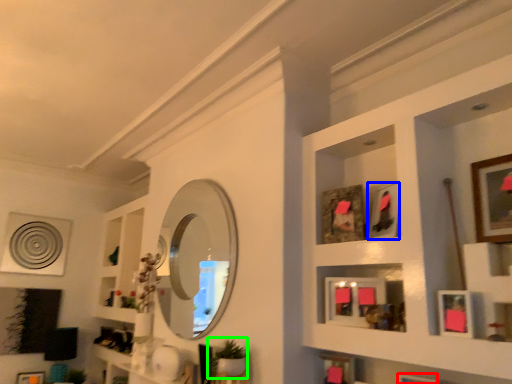
Question: Based on their relative distances, which object is farther from picture frame (highlighted by a red box)? Choose from picture frame (highlighted by a blue box) and plant (highlighted by a green box).

Choices:
 (A) picture frame
 (B) plant

Answer: (B)